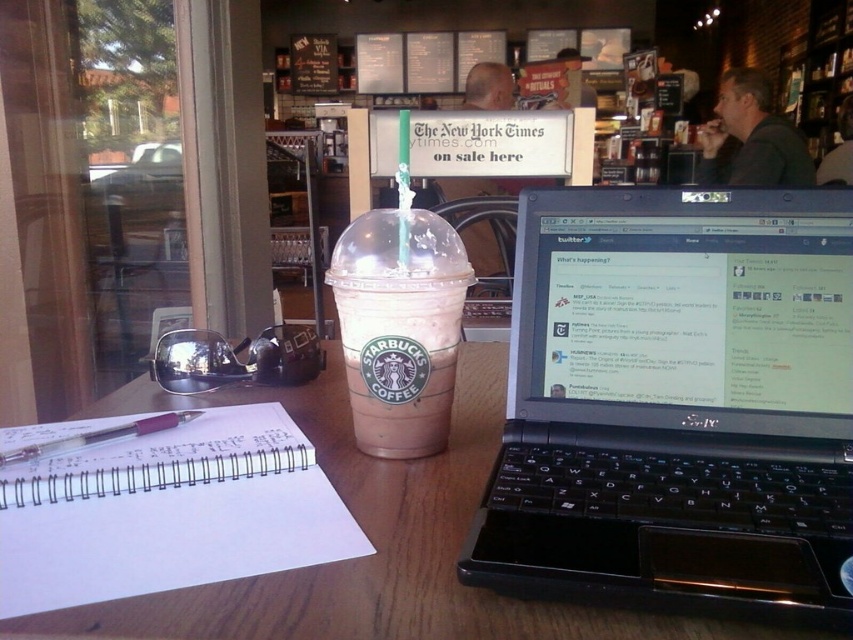
You are trying to place the translucent plastic pen at lower left into a pocket that can only fit items shorter than the white spiral notebook at center. Based on the scene, will the pen fit?

The white spiral notebook at center has a greater height compared to the translucent plastic pen at lower left, so the pen is shorter and will fit into the pocket.

You are organizing items on a table and need to place a black plastic laptop at center and a translucent plastic pen at lower left. Based on the scene, where should you position the pen relative to the laptop?

The black plastic laptop at center is to the right of the translucent plastic pen at lower left, so the pen should be placed to the left of the laptop.

You are sitting at the wooden table in the foreground of the cozy cafe scene. There are two points marked on the table surface. One is at coordinates point (405, 525) and the other is at point (131, 448). Which of these two points is closer to you?

Point (405, 525) is closer to you because it is closer to the camera than point (131, 448).